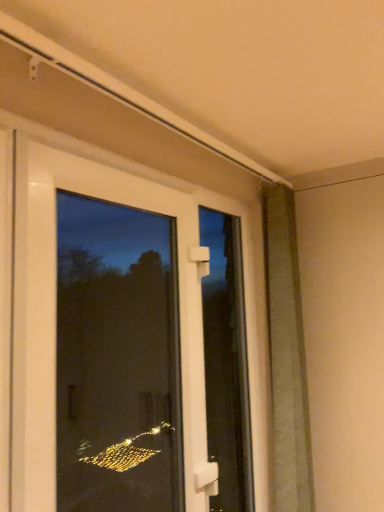
Question: Considering the positions of point (281, 351) and point (208, 245), is point (281, 351) closer or farther from the camera than point (208, 245)?

Choices:
 (A) closer
 (B) farther

Answer: (A)

Question: Do you think green textured curtain at right is within white plastic handle at center, or outside of it?

Choices:
 (A) inside
 (B) outside

Answer: (B)

Question: Estimate the real-world distances between objects in this image. Which object is closer to the white plastic handle at center?

Choices:
 (A) green textured curtain at right
 (B) white plastic door at center

Answer: (A)

Question: Based on their relative distances, which object is nearer to the green textured curtain at right?

Choices:
 (A) white plastic handle at center
 (B) white plastic door at center

Answer: (A)